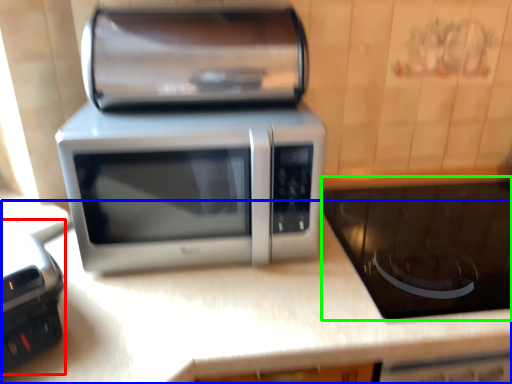
Question: Estimate the real-world distances between objects in this image. Which object is farther from appliance (highlighted by a red box), counter top (highlighted by a blue box) or appliance (highlighted by a green box)?

Choices:
 (A) counter top
 (B) appliance

Answer: (B)